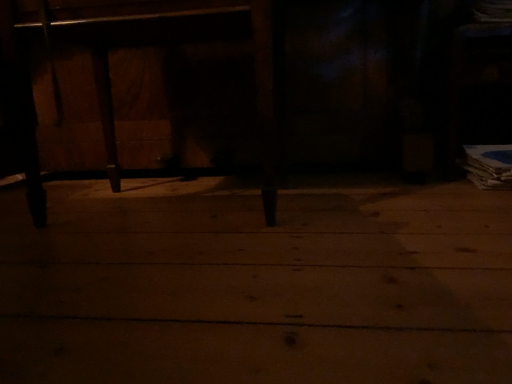
You are a GUI agent. You are given a task and a screenshot of the screen. Output one action in this format:
    pyautogui.click(x=<x>, y=<y>)
    Task: Click on the wooden table at center
    
    Given the screenshot: What is the action you would take?
    pyautogui.click(x=254, y=86)

What do you see at coordinates (254, 86) in the screenshot? The image size is (512, 384). I see `wooden table at center` at bounding box center [254, 86].

Measure the distance between wooden table at center and camera.

The distance of wooden table at center from camera is 27.62 inches.

In order to face wooden table at center, should I rotate leftwards or rightwards?

To face it directly, rotate left by 3.440 degrees.

Identify the location of wooden floor at center. (257, 283).

What do you see at coordinates (257, 283) in the screenshot? The image size is (512, 384). I see `wooden floor at center` at bounding box center [257, 283].

Consider the image. In order to face wooden floor at center, should I rotate leftwards or rightwards?

It's best to rotate right around 0.807 degrees.

Identify the location of wooden table at center. Image resolution: width=512 pixels, height=384 pixels. (254, 86).

Which is more to the left, wooden floor at center or wooden table at center?

From the viewer's perspective, wooden table at center appears more on the left side.

Which is behind, wooden floor at center or wooden table at center?

wooden table at center is further from the camera.

Which is nearer, [477,237] or [254,94]?

The point [477,237] is closer.

From the image's perspective, between wooden floor at center and wooden table at center, which one is located above?

From the image's view, wooden table at center is above.

From a real-world perspective, is wooden floor at center on wooden table at center?

Actually, wooden floor at center is physically below wooden table at center in the real world.

Is wooden floor at center wider than wooden table at center?

Yes.

Is wooden floor at center taller or shorter than wooden table at center?

wooden floor at center is shorter than wooden table at center.

Based on the photo, between wooden floor at center and wooden table at center, which one has larger size?

With larger size is wooden table at center.

Can wooden table at center be found inside wooden floor at center?

No, wooden table at center is located outside of wooden floor at center.

Can you see wooden floor at center touching wooden table at center?

wooden floor at center and wooden table at center are not in contact.

Is wooden floor at center turned away from wooden table at center?

wooden floor at center does not have its back to wooden table at center.

How different are the orientations of wooden floor at center and wooden table at center in degrees?

There is a 91.3-degree angle between the facing directions of wooden floor at center and wooden table at center.

Locate an element on the screen. furniture above the wooden floor at center (from the image's perspective) is located at coordinates (254, 86).

Visually, is wooden table at center positioned to the left or to the right of wooden floor at center?

In the image, wooden table at center appears on the left side of wooden floor at center.

Which object is closer to the camera, wooden table at center or wooden floor at center?

wooden floor at center is in front.

Is point (249, 21) closer or farther from the camera than point (386, 278)?

Point (249, 21) appears to be farther away from the viewer than point (386, 278).

From the image's perspective, would you say wooden table at center is positioned over wooden floor at center?

Yes, from the image's perspective, wooden table at center is above wooden floor at center.

From a real-world perspective, is wooden table at center on top of wooden floor at center?

Correct, in the physical world, wooden table at center is higher than wooden floor at center.

Which of these two, wooden table at center or wooden floor at center, is wider?

With larger width is wooden floor at center.

Considering the sizes of wooden table at center and wooden floor at center in the image, is wooden table at center taller or shorter than wooden floor at center?

Considering their sizes, wooden table at center has more height than wooden floor at center.

Is wooden table at center bigger than wooden floor at center?

Yes.

Is wooden table at center spatially inside wooden floor at center, or outside of it?

wooden table at center exists outside the volume of wooden floor at center.

Is wooden table at center with wooden floor at center?

wooden table at center and wooden floor at center are clearly separated.

Is wooden table at center facing away from wooden floor at center?

No, wooden table at center is not facing away from wooden floor at center.

I want to click on furniture that appears above the wooden floor at center (from a real-world perspective), so click(x=254, y=86).

In the image, there is a wooden floor at center. Find the location of `furniture above it (from the image's perspective)`. furniture above it (from the image's perspective) is located at coordinates (254, 86).

Image resolution: width=512 pixels, height=384 pixels. I want to click on furniture located behind the wooden floor at center, so click(x=254, y=86).